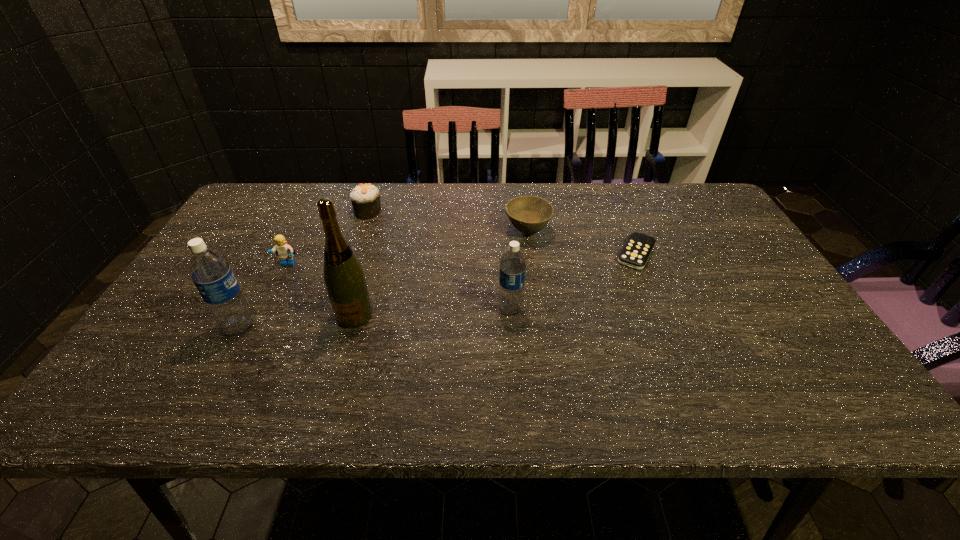
Find the location of a particular element. vacant space located on the back of the taller water bottle is located at coordinates [x=270, y=272].

This screenshot has height=540, width=960. Find the location of `free space located 0.180m on the left of the right water bottle`. free space located 0.180m on the left of the right water bottle is located at coordinates (424, 309).

At what (x,y) coordinates should I click in order to perform the action: click on vacant region located on the front of the cupcake. Please return your answer as a coordinate pair (x, y). This screenshot has height=540, width=960. Looking at the image, I should click on (361, 234).

In order to click on vacant area situated on the left of the rightmost object in this screenshot , I will do `click(589, 253)`.

At what (x,y) coordinates should I click in order to perform the action: click on free region located on the front-facing side of the wine bottle. Please return your answer as a coordinate pair (x, y). The width and height of the screenshot is (960, 540). Looking at the image, I should click on (342, 361).

The image size is (960, 540). I want to click on vacant space located 0.140m on the front-facing side of the Lego, so click(266, 308).

At what (x,y) coordinates should I click in order to perform the action: click on blank space located 0.070m on the right of the bowl. Please return your answer as a coordinate pair (x, y). Looking at the image, I should click on (574, 232).

This screenshot has height=540, width=960. In order to click on cupcake situated at the far edge in this screenshot , I will do `click(365, 198)`.

In order to click on bowl at the far edge in this screenshot , I will do tap(528, 214).

At what (x,y) coordinates should I click in order to perform the action: click on vacant space at the far edge of the desktop. Please return your answer as a coordinate pair (x, y). This screenshot has width=960, height=540. Looking at the image, I should click on (473, 215).